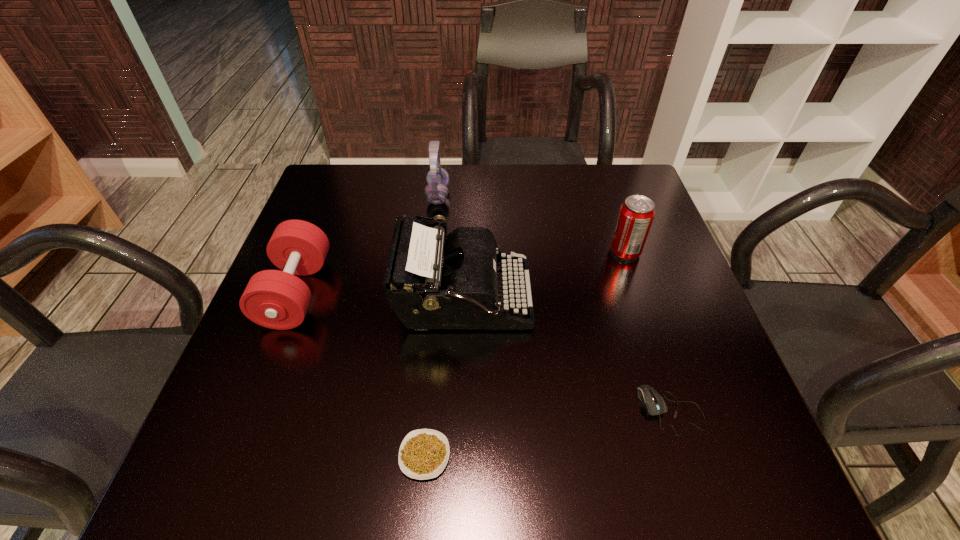
The height and width of the screenshot is (540, 960). Identify the location of headset. (436, 192).

Where is `typewriter`? The image size is (960, 540). typewriter is located at coordinates (429, 284).

Locate an element on the screen. soda is located at coordinates (636, 214).

You are a GUI agent. You are given a task and a screenshot of the screen. Output one action in this format:
    pyautogui.click(x=<x>, y=<y>)
    Task: Click on the leftmost object
    
    Given the screenshot: What is the action you would take?
    pyautogui.click(x=275, y=299)

Identify the location of dumbbell. The height and width of the screenshot is (540, 960). (275, 299).

Image resolution: width=960 pixels, height=540 pixels. I want to click on computer mouse, so click(x=654, y=404).

Find the location of `legume`. legume is located at coordinates (423, 454).

Identify the location of free space located on the headband and ear cups of the farthest object. (475, 195).

What are the coordinates of `free space located 0.220m on the typing side of the typewriter` in the screenshot? It's located at (635, 299).

At what (x,y) coordinates should I click in order to perform the action: click on vacant space located 0.170m on the back of the soda. Please return your answer as a coordinate pair (x, y). Looking at the image, I should click on (608, 199).